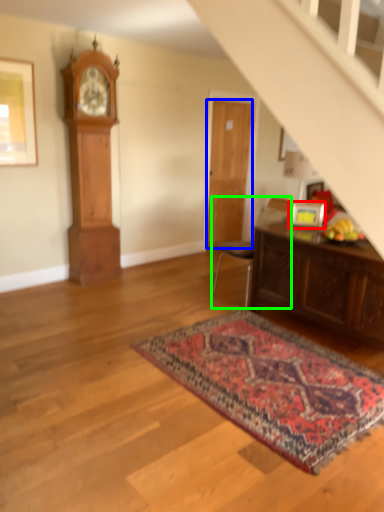
Question: Which object is the closest to the picture frame (highlighted by a red box)? Choose among these: door (highlighted by a blue box) or chair (highlighted by a green box).

Choices:
 (A) door
 (B) chair

Answer: (B)